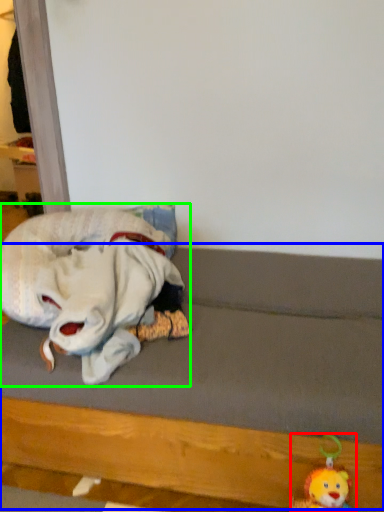
Question: Considering the real-world distances, which object is closest to toy (highlighted by a red box)? bed frame (highlighted by a blue box) or toy (highlighted by a green box).

Choices:
 (A) bed frame
 (B) toy

Answer: (A)